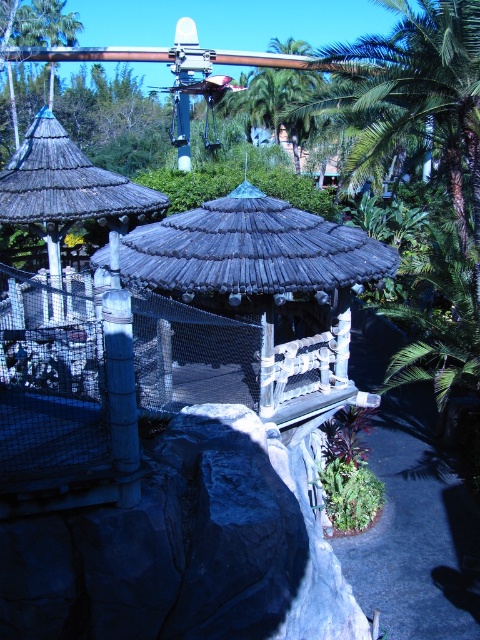
Question: In this image, where is wooden thatched roof gazebo at center located relative to smooth bamboo pole at center?

Choices:
 (A) left
 (B) right

Answer: (B)

Question: Is wooden thatched roof gazebo at center wider than smooth bamboo pole at center?

Choices:
 (A) no
 (B) yes

Answer: (B)

Question: Does wooden thatched roof gazebo at center have a lesser width compared to smooth bamboo pole at center?

Choices:
 (A) yes
 (B) no

Answer: (B)

Question: Which of the following is the closest to the observer?

Choices:
 (A) (274, 394)
 (B) (124, 408)

Answer: (B)

Question: Which of the following is the farthest from the observer?

Choices:
 (A) wooden thatched roof gazebo at center
 (B) smooth bamboo pole at center

Answer: (A)